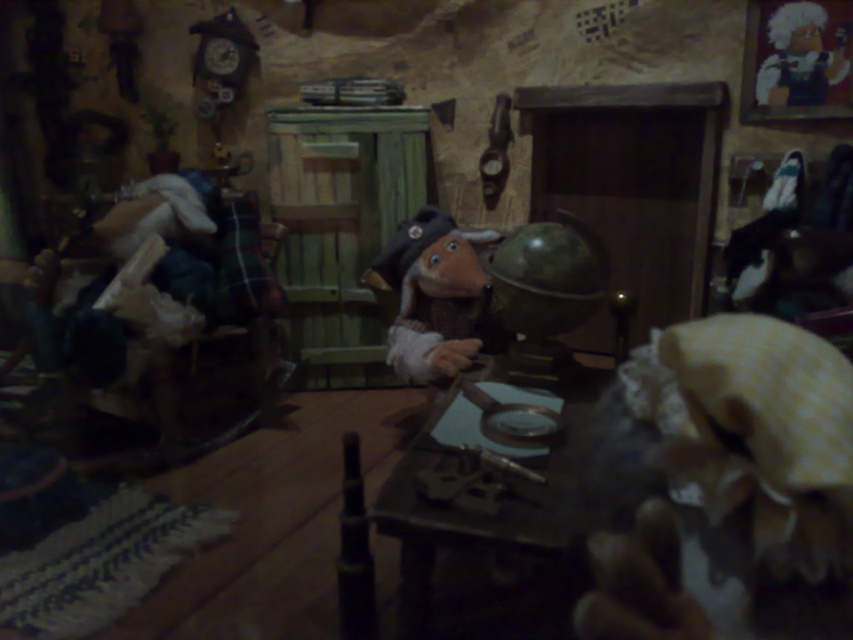
Question: Where is wooden table at center located in relation to matte brown wooden toy at center in the image?

Choices:
 (A) below
 (B) above

Answer: (A)

Question: Which point is farther to the camera?

Choices:
 (A) (547, 460)
 (B) (495, 240)

Answer: (B)

Question: Which point is farther to the camera?

Choices:
 (A) wooden table at center
 (B) matte brown wooden toy at center

Answer: (B)

Question: Does wooden table at center have a greater width compared to matte brown wooden toy at center?

Choices:
 (A) no
 (B) yes

Answer: (B)

Question: Is wooden table at center smaller than matte brown wooden toy at center?

Choices:
 (A) no
 (B) yes

Answer: (B)

Question: Which object is closer to the camera taking this photo?

Choices:
 (A) matte brown wooden toy at center
 (B) wooden table at center

Answer: (B)